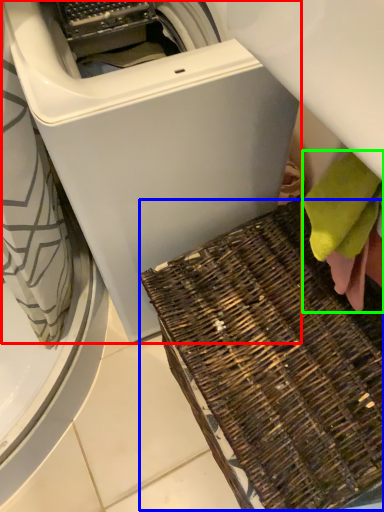
Question: Which object is positioned closest to washing machine (highlighted by a red box)? Select from waste (highlighted by a blue box) and bath towel (highlighted by a green box).

Choices:
 (A) waste
 (B) bath towel

Answer: (A)